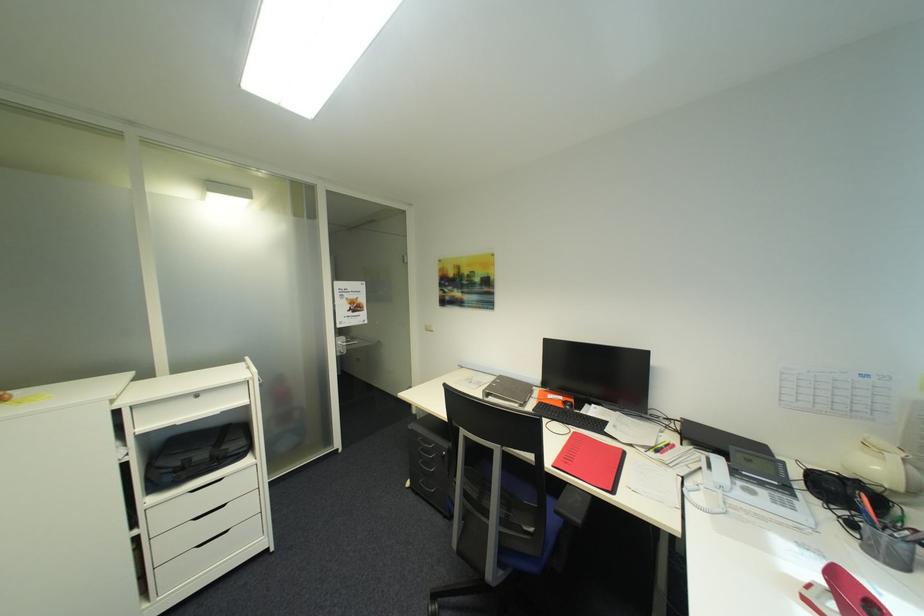
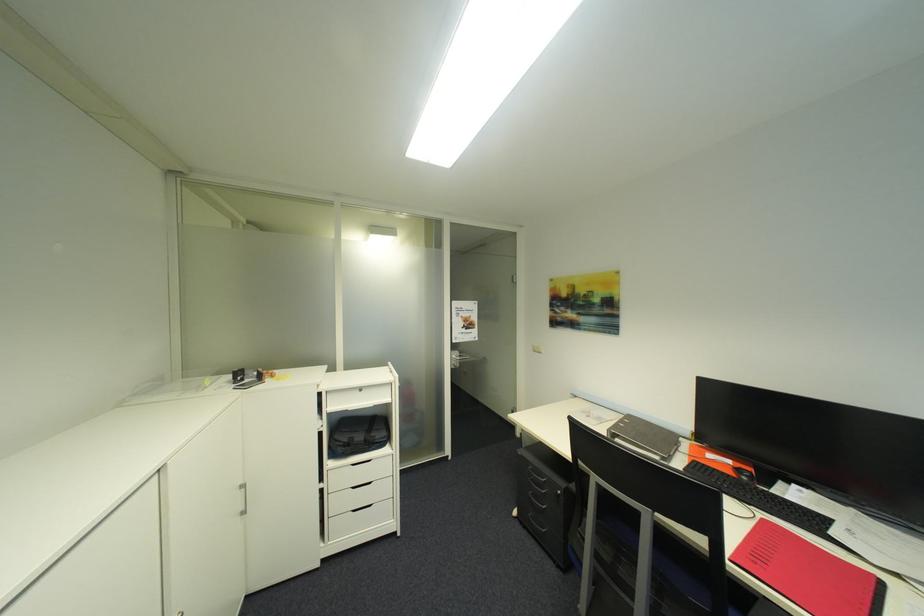
In the second image, find the point that corresponds to the point at 238,450 in the first image.

(384, 438)